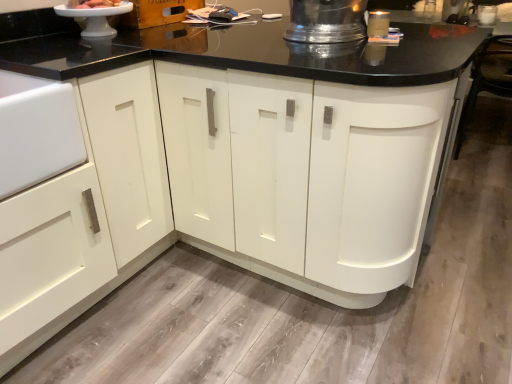
Question: Is white glossy cake stand at upper left, placed as the 1th appliance when sorted from left to right, completely or partially outside of white glossy cake at upper left?

Choices:
 (A) no
 (B) yes

Answer: (B)

Question: Are white glossy cake stand at upper left, placed as the 2th appliance when sorted from right to left, and white glossy cake at upper left located far from each other?

Choices:
 (A) yes
 (B) no

Answer: (B)

Question: Is white glossy cake stand at upper left, placed as the 1th appliance when sorted from left to right, oriented towards white glossy cake at upper left?

Choices:
 (A) yes
 (B) no

Answer: (B)

Question: Does white glossy cake stand at upper left, placed as the 1th appliance when sorted from left to right, have a lesser width compared to white glossy cake at upper left?

Choices:
 (A) no
 (B) yes

Answer: (A)

Question: Considering the relative positions of white glossy cake stand at upper left, placed as the 1th appliance when sorted from left to right, and white glossy cake at upper left in the image provided, is white glossy cake stand at upper left, placed as the 1th appliance when sorted from left to right, to the left of white glossy cake at upper left from the viewer's perspective?

Choices:
 (A) yes
 (B) no

Answer: (A)

Question: Looking at their shapes, would you say white glossy cake stand at upper left, placed as the 2th appliance when sorted from right to left, is wider or thinner than white glossy cake at upper left?

Choices:
 (A) thin
 (B) wide

Answer: (B)

Question: From the image's perspective, is white glossy cake stand at upper left, placed as the 1th appliance when sorted from left to right, above or below white glossy cake at upper left?

Choices:
 (A) above
 (B) below

Answer: (B)

Question: Considering the positions of white glossy cake stand at upper left, placed as the 2th appliance when sorted from right to left, and white glossy cake at upper left in the image, is white glossy cake stand at upper left, placed as the 2th appliance when sorted from right to left, taller or shorter than white glossy cake at upper left?

Choices:
 (A) short
 (B) tall

Answer: (B)

Question: Is point (95, 29) positioned closer to the camera than point (80, 1)?

Choices:
 (A) closer
 (B) farther

Answer: (B)

Question: Considering the positions of white glossy cake at upper left and white glossy cake stand at upper left, placed as the 1th appliance when sorted from left to right, in the image, is white glossy cake at upper left taller or shorter than white glossy cake stand at upper left, placed as the 1th appliance when sorted from left to right,?

Choices:
 (A) short
 (B) tall

Answer: (A)

Question: Based on their sizes in the image, would you say white glossy cake at upper left is bigger or smaller than white glossy cake stand at upper left, placed as the 2th appliance when sorted from right to left?

Choices:
 (A) big
 (B) small

Answer: (B)

Question: Is point (77, 4) closer or farther from the camera than point (119, 3)?

Choices:
 (A) closer
 (B) farther

Answer: (A)

Question: Is white glossy cake at upper left situated inside white glossy cake stand at upper left, placed as the 1th appliance when sorted from left to right, or outside?

Choices:
 (A) inside
 (B) outside

Answer: (B)

Question: From the image's perspective, is shiny metallic pitcher at upper center, the 2th appliance in the left-to-right sequence, above or below white glossy cake at upper left?

Choices:
 (A) below
 (B) above

Answer: (A)

Question: Is shiny metallic pitcher at upper center, placed as the 1th appliance when sorted from right to left, wider or thinner than white glossy cake at upper left?

Choices:
 (A) wide
 (B) thin

Answer: (A)